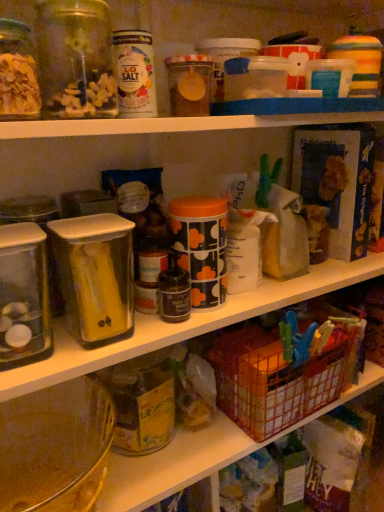
Question: From the image's perspective, is metallic wire basket at lower right located above or below translucent glass jar at lower center, which is counted as the second glass jar, starting from the front?

Choices:
 (A) above
 (B) below

Answer: (A)

Question: Is metallic wire basket at lower right wider or thinner than translucent glass jar at lower center, the second glass jar from the top?

Choices:
 (A) thin
 (B) wide

Answer: (B)

Question: Which object is positioned closest to the metallic wire basket at lower right?

Choices:
 (A) clear plastic canister at center-left
 (B) clear glass jar at upper left, which is counted as the 1th glass jar, starting from the front
 (C) translucent glass jar at lower center, which is the 1th glass jar from bottom to top

Answer: (C)

Question: Which object is positioned closest to the clear glass jar at upper left, which is counted as the 1th glass jar, starting from the front?

Choices:
 (A) clear plastic canister at center-left
 (B) translucent glass jar at lower center, which is the 1th glass jar from bottom to top
 (C) metallic wire basket at lower right

Answer: (A)